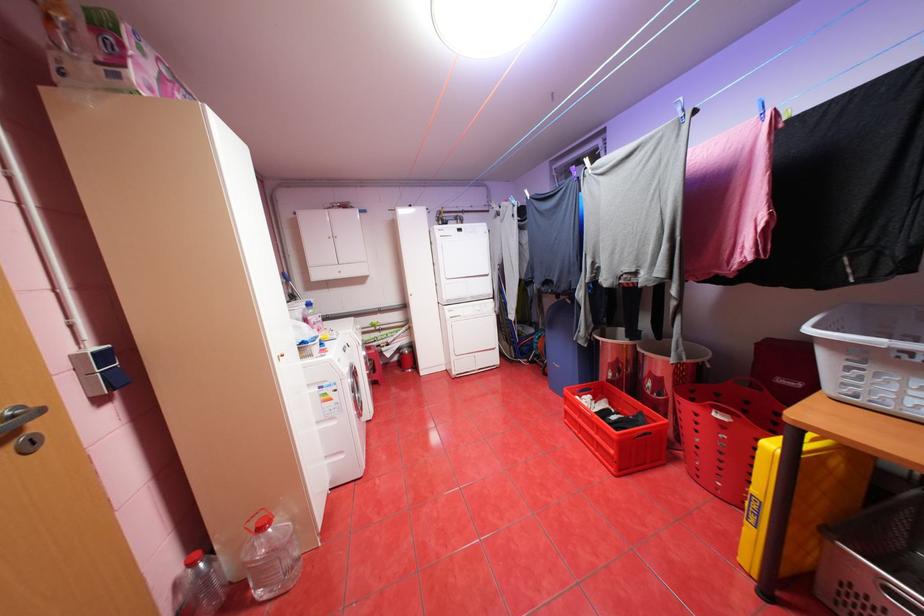
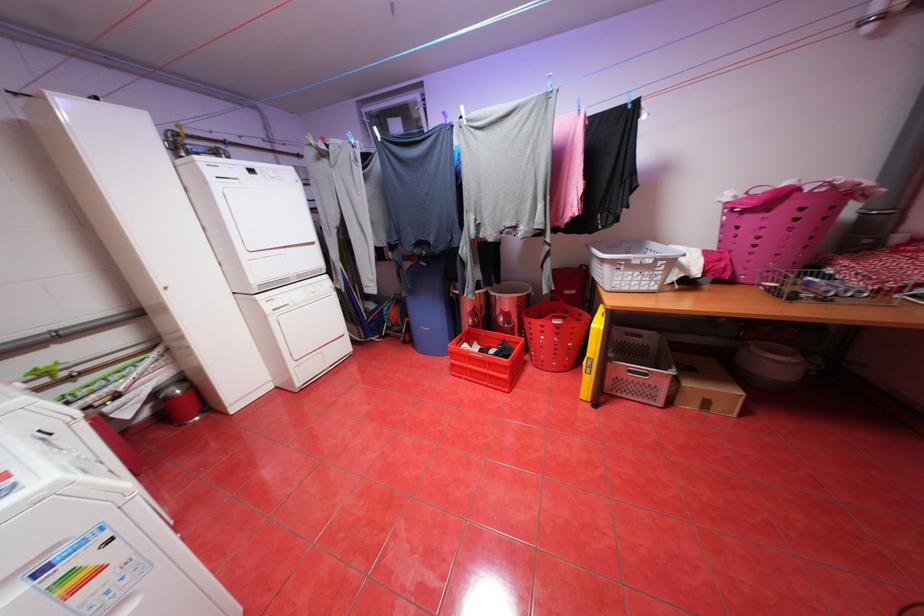
Find the pixel in the second image that matches [618,403] in the first image.

(488, 344)